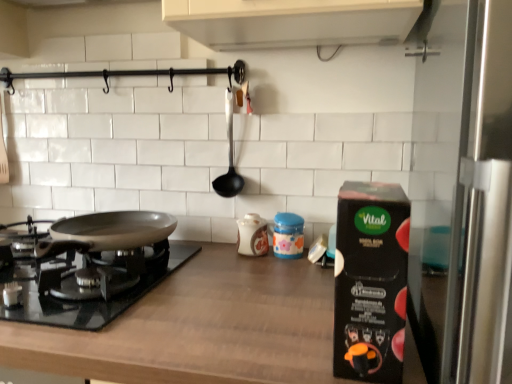
Identify the location of free space between silver metallic pan at lower left and matte ceramic jar at center, the 2th kitchen appliance when ordered from back to front. The height and width of the screenshot is (384, 512). (214, 272).